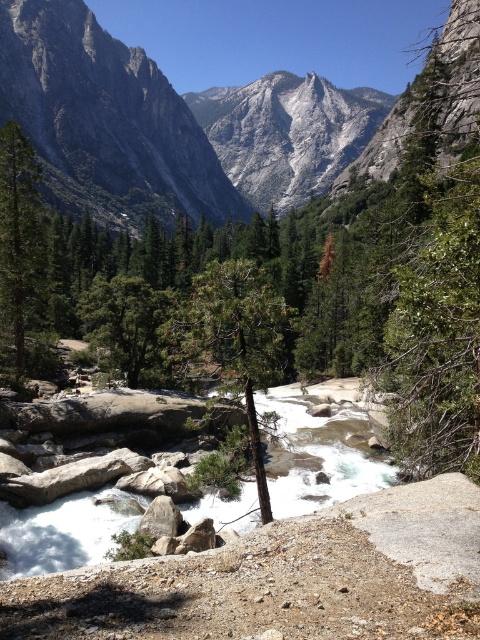
Does green leafy tree at upper center appear over green textured tree at center?

Indeed, green leafy tree at upper center is positioned over green textured tree at center.

Which is behind, point (393, 122) or point (262, 372)?

The point (393, 122) is more distant.

The width and height of the screenshot is (480, 640). What are the coordinates of `green leafy tree at upper center` in the screenshot? It's located at (435, 253).

In the scene shown: Does gray granite mountain at upper center have a greater width compared to green matte tree at left?

Indeed, gray granite mountain at upper center has a greater width compared to green matte tree at left.

How distant is gray granite mountain at upper center from green matte tree at left?

gray granite mountain at upper center is 144.70 meters away from green matte tree at left.

The height and width of the screenshot is (640, 480). I want to click on gray granite mountain at upper center, so click(x=105, y=120).

Find the location of a particular element. gray granite mountain at upper center is located at coordinates (105, 120).

Is point (94, 81) behind point (191, 356)?

Yes, it is.

Between gray granite mountain at upper center and green textured tree at center, which one has less height?

green textured tree at center

Is point (72, 109) positioned before point (273, 364)?

No, (72, 109) is behind (273, 364).

Identify the location of gray granite mountain at upper center. The width and height of the screenshot is (480, 640). (105, 120).